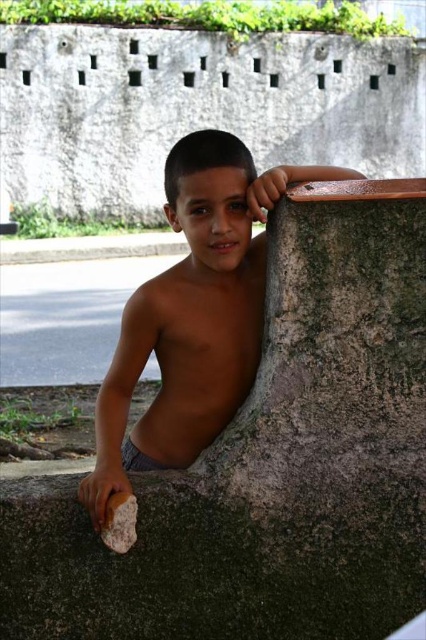
Question: Is green mossy concrete at upper center wider than brown matte stone at center?

Choices:
 (A) yes
 (B) no

Answer: (B)

Question: Is green mossy concrete at upper center to the right of brown matte stone at center from the viewer's perspective?

Choices:
 (A) yes
 (B) no

Answer: (A)

Question: Can you confirm if green mossy concrete at upper center is positioned to the left of brown matte stone at center?

Choices:
 (A) no
 (B) yes

Answer: (A)

Question: Which point is farther to the camera?

Choices:
 (A) brown matte stone at center
 (B) green mossy concrete at upper center

Answer: (B)